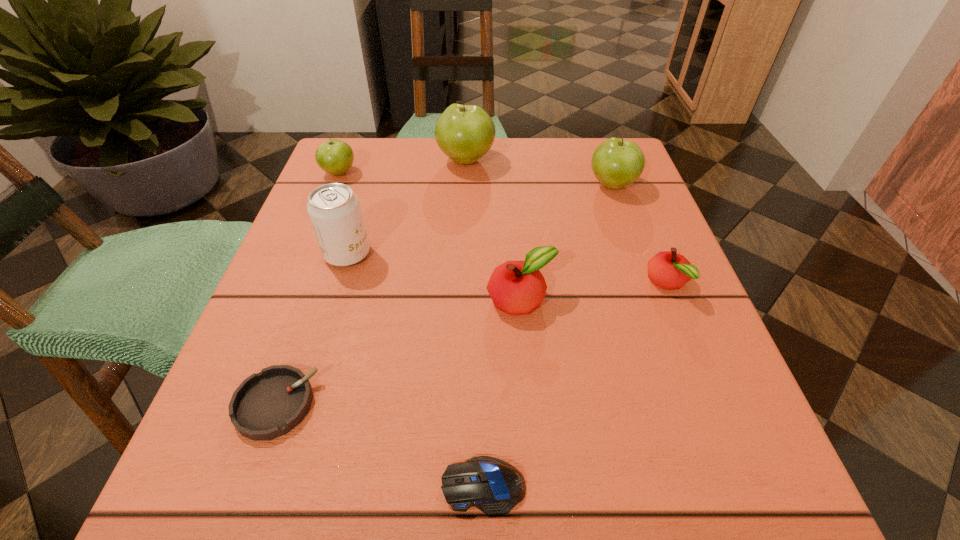
Identify the location of free point between the ashtray and the second green apple from left to right. (371, 282).

The height and width of the screenshot is (540, 960). I want to click on free space between the biggest green apple and the bigger red apple, so click(493, 230).

Find the location of a particular element. This screenshot has width=960, height=540. vacant space that is in between the second tallest apple and the smallest green apple is located at coordinates (476, 179).

Point out which object is positioned as the second nearest to the nearest object. Please provide its 2D coordinates. Your answer should be formatted as a tuple, i.e. [(x, y)], where the tuple contains the x and y coordinates of a point satisfying the conditions above.

[(516, 287)]

The width and height of the screenshot is (960, 540). I want to click on the seventh closest object to the nearest object, so click(x=335, y=157).

At what (x,y) coordinates should I click in order to perform the action: click on apple object that ranks as the fourth closest to the second green apple from right to left. Please return your answer as a coordinate pair (x, y). The image size is (960, 540). Looking at the image, I should click on (669, 270).

This screenshot has height=540, width=960. Find the location of `the fourth closest apple relative to the left red apple`. the fourth closest apple relative to the left red apple is located at coordinates (335, 157).

Choose which green apple is the second nearest neighbor to the right red apple. Please provide its 2D coordinates. Your answer should be formatted as a tuple, i.e. [(x, y)], where the tuple contains the x and y coordinates of a point satisfying the conditions above.

[(465, 133)]

At what (x,y) coordinates should I click in order to perform the action: click on green apple that is the third closest one to the bigger red apple. Please return your answer as a coordinate pair (x, y). Image resolution: width=960 pixels, height=540 pixels. Looking at the image, I should click on (335, 157).

At what (x,y) coordinates should I click in order to perform the action: click on vacant region that satisfies the following two spatial constraints: 1. on the front side of the leftmost apple; 2. on the left side of the third shortest object. Please return your answer as a coordinate pair (x, y). Looking at the image, I should click on (295, 284).